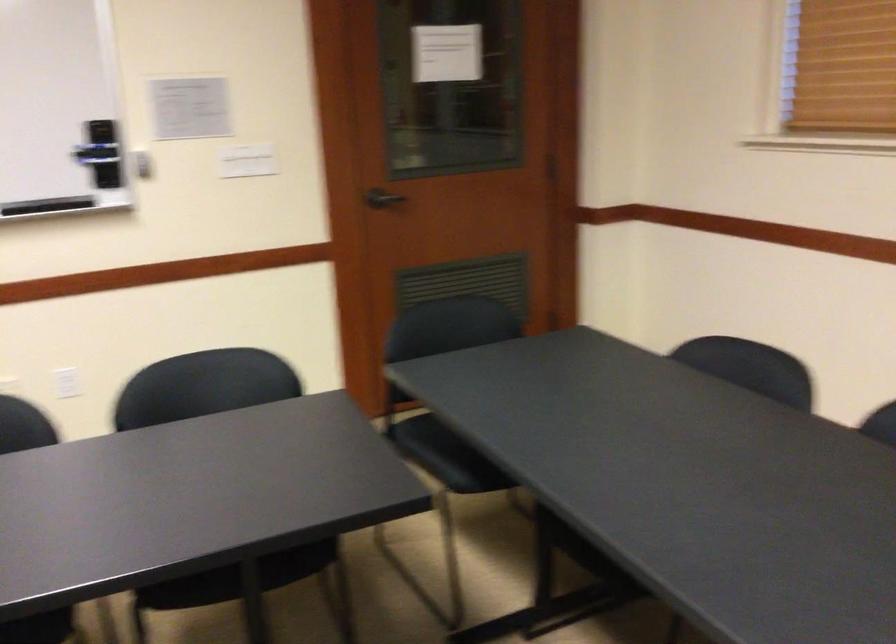
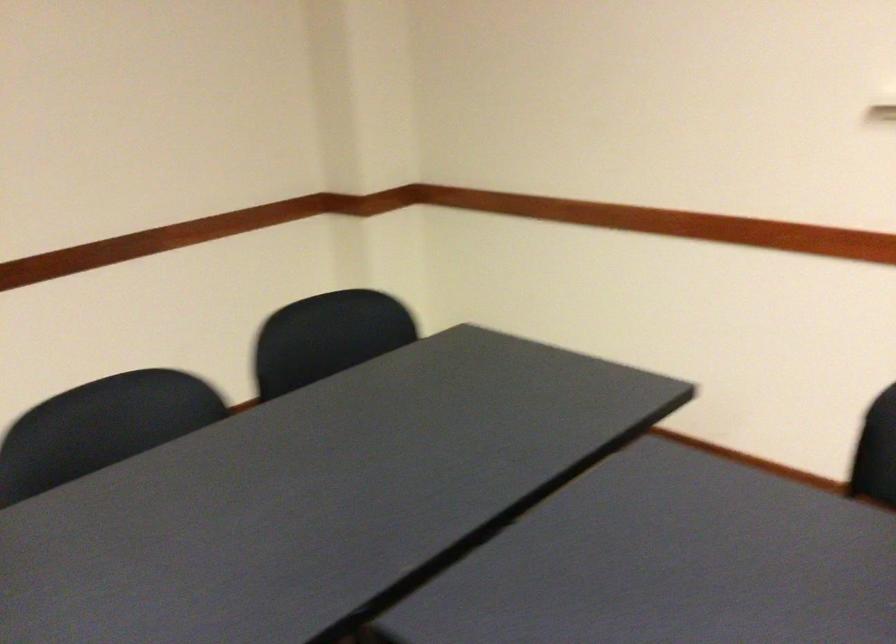
Based on the continuous images, in which direction is the camera rotating?

The camera rotated toward right-down.